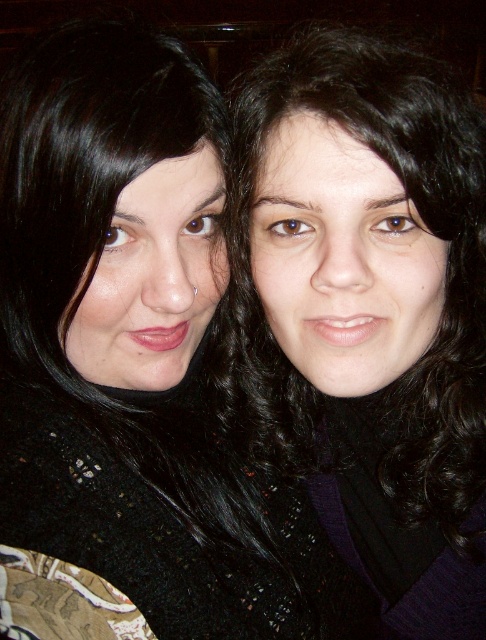
Question: Is black matte hair at center to the left of black curly hair at upper right from the viewer's perspective?

Choices:
 (A) yes
 (B) no

Answer: (A)

Question: Which of the following is the closest to the observer?

Choices:
 (A) black curly hair at upper right
 (B) black matte hair at center

Answer: (A)

Question: Can you confirm if black matte hair at center is positioned below black curly hair at upper right?

Choices:
 (A) no
 (B) yes

Answer: (B)

Question: Which object is closer to the camera taking this photo?

Choices:
 (A) black matte hair at center
 (B) black curly hair at upper right

Answer: (B)

Question: Can you confirm if black matte hair at center is positioned above black curly hair at upper right?

Choices:
 (A) no
 (B) yes

Answer: (A)